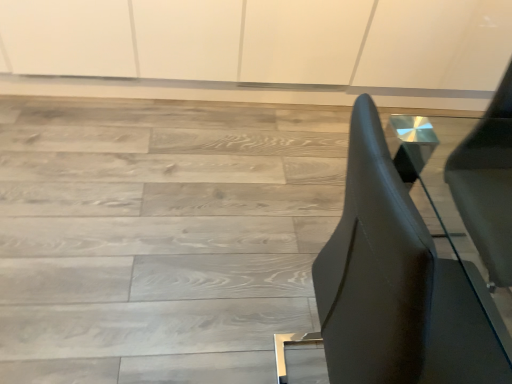
Measure the distance between matte wood floor at center and camera.

A distance of 4.18 feet exists between matte wood floor at center and camera.

The width and height of the screenshot is (512, 384). Describe the element at coordinates (160, 236) in the screenshot. I see `matte wood floor at center` at that location.

In order to face matte wood floor at center, should I rotate leftwards or rightwards?

Rotate right and turn 4.012 degrees.

Consider the image. What is the approximate width of matte wood floor at center?

matte wood floor at center is 2.83 meters wide.

Identify the location of matte wood floor at center. (160, 236).

What do you see at coordinates (392, 289) in the screenshot? The width and height of the screenshot is (512, 384). I see `metallic silver side table at center` at bounding box center [392, 289].

Where is `metallic silver side table at center`? The height and width of the screenshot is (384, 512). metallic silver side table at center is located at coordinates (392, 289).

Locate an element on the screen. matte wood floor at center is located at coordinates (160, 236).

Can you confirm if matte wood floor at center is positioned to the left of metallic silver side table at center?

Correct, you'll find matte wood floor at center to the left of metallic silver side table at center.

Considering the positions of objects matte wood floor at center and metallic silver side table at center in the image provided, who is in front, matte wood floor at center or metallic silver side table at center?

metallic silver side table at center is in front.

Which is closer, [318,150] or [397,301]?

Point [318,150] is farther from the camera than point [397,301].

From the image's perspective, which one is positioned lower, matte wood floor at center or metallic silver side table at center?

metallic silver side table at center, from the image's perspective.

From a real-world perspective, is matte wood floor at center over metallic silver side table at center?

No.

Can you confirm if matte wood floor at center is wider than metallic silver side table at center?

Indeed, matte wood floor at center has a greater width compared to metallic silver side table at center.

Who is shorter, matte wood floor at center or metallic silver side table at center?

With less height is matte wood floor at center.

From the picture: Considering the sizes of objects matte wood floor at center and metallic silver side table at center in the image provided, who is bigger, matte wood floor at center or metallic silver side table at center?

Bigger between the two is matte wood floor at center.

Is matte wood floor at center completely or partially outside of metallic silver side table at center?

Yes, matte wood floor at center is outside of metallic silver side table at center.

Is the surface of matte wood floor at center in direct contact with metallic silver side table at center?

No, matte wood floor at center is not with metallic silver side table at center.

Could you tell me if matte wood floor at center is turned towards metallic silver side table at center?

No, matte wood floor at center is not facing towards metallic silver side table at center.

What's the angular difference between matte wood floor at center and metallic silver side table at center's facing directions?

The facing directions of matte wood floor at center and metallic silver side table at center are 1.55 degrees apart.

Locate an element on the screen. furniture below the matte wood floor at center (from the image's perspective) is located at coordinates (392, 289).

Considering the positions of objects metallic silver side table at center and matte wood floor at center in the image provided, who is more to the right, metallic silver side table at center or matte wood floor at center?

Positioned to the right is metallic silver side table at center.

Is metallic silver side table at center in front of or behind matte wood floor at center in the image?

metallic silver side table at center is in front of matte wood floor at center.

Does point (386, 237) come farther from viewer compared to point (211, 248)?

That is False.

From the image's perspective, is metallic silver side table at center over matte wood floor at center?

No, from the image's perspective, metallic silver side table at center is not above matte wood floor at center.

From a real-world perspective, is metallic silver side table at center below matte wood floor at center?

Actually, metallic silver side table at center is physically above matte wood floor at center in the real world.

In terms of width, does metallic silver side table at center look wider or thinner when compared to matte wood floor at center?

In the image, metallic silver side table at center appears to be more narrow than matte wood floor at center.

Can you confirm if metallic silver side table at center is shorter than matte wood floor at center?

No.

Does metallic silver side table at center have a smaller size compared to matte wood floor at center?

Yes.

Is metallic silver side table at center outside of matte wood floor at center?

Yes, metallic silver side table at center is located beyond the bounds of matte wood floor at center.

Are metallic silver side table at center and matte wood floor at center making contact?

No, metallic silver side table at center is not making contact with matte wood floor at center.

Is metallic silver side table at center oriented towards matte wood floor at center?

No, metallic silver side table at center is not oriented towards matte wood floor at center.

How many degrees apart are the facing directions of metallic silver side table at center and matte wood floor at center?

1.55 degrees separate the facing orientations of metallic silver side table at center and matte wood floor at center.

The height and width of the screenshot is (384, 512). I want to click on stairwell above the metallic silver side table at center (from the image's perspective), so click(160, 236).

You are a GUI agent. You are given a task and a screenshot of the screen. Output one action in this format:
    pyautogui.click(x=<x>, y=<y>)
    Task: Click on the furniture located below the matte wood floor at center (from the image's perspective)
    Image resolution: width=512 pixels, height=384 pixels.
    Given the screenshot: What is the action you would take?
    pyautogui.click(x=392, y=289)

Identify the location of stairwell located above the metallic silver side table at center (from the image's perspective). (160, 236).